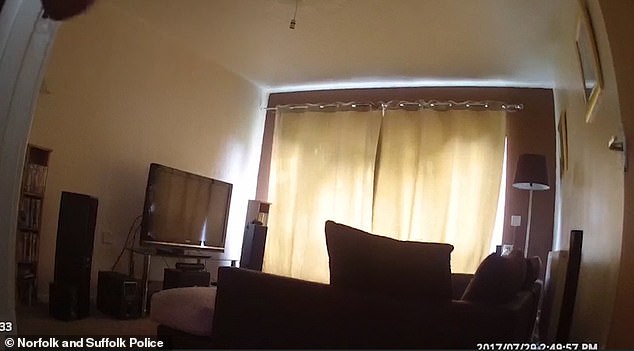
The width and height of the screenshot is (634, 351). I want to click on light tan curtains, so click(x=326, y=152), click(x=440, y=150).